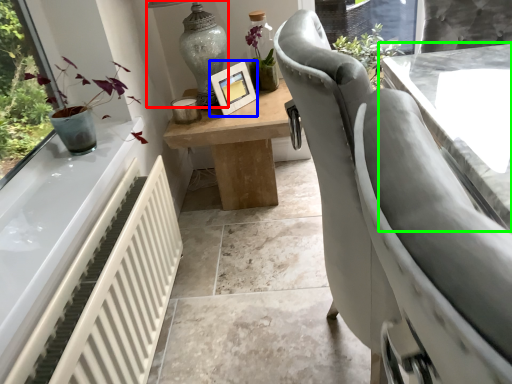
Question: Estimate the real-world distances between objects in this image. Which object is closer to lamp (highlighted by a red box), picture frame (highlighted by a blue box) or table (highlighted by a green box)?

Choices:
 (A) picture frame
 (B) table

Answer: (A)